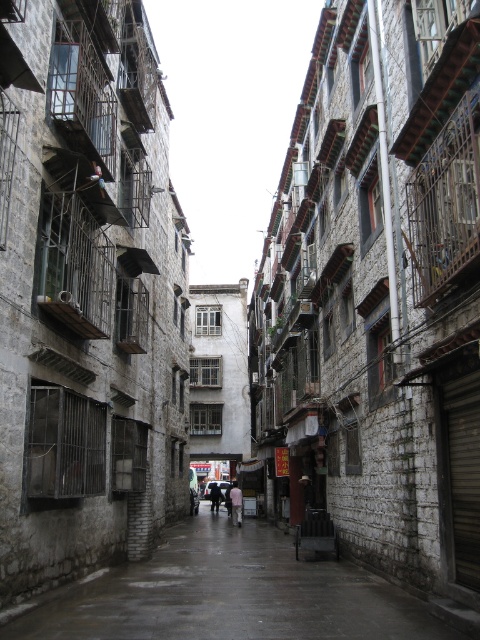
Question: Is smooth stone pavement at center wider than pink fabric person at center?

Choices:
 (A) no
 (B) yes

Answer: (B)

Question: Is smooth stone pavement at center smaller than dark gray fabric coat at center?

Choices:
 (A) yes
 (B) no

Answer: (B)

Question: Which point appears farthest from the camera in this image?

Choices:
 (A) (232, 522)
 (B) (211, 504)

Answer: (B)

Question: Which point is farther to the camera?

Choices:
 (A) pink fabric person at center
 (B) transparent plastic umbrella at center

Answer: (B)

Question: Which of the following is the farthest from the observer?

Choices:
 (A) smooth stone pavement at center
 (B) transparent plastic umbrella at center
 (C) pink fabric person at center

Answer: (B)

Question: Can you confirm if smooth stone pavement at center is positioned above dark gray fabric coat at center?

Choices:
 (A) no
 (B) yes

Answer: (B)